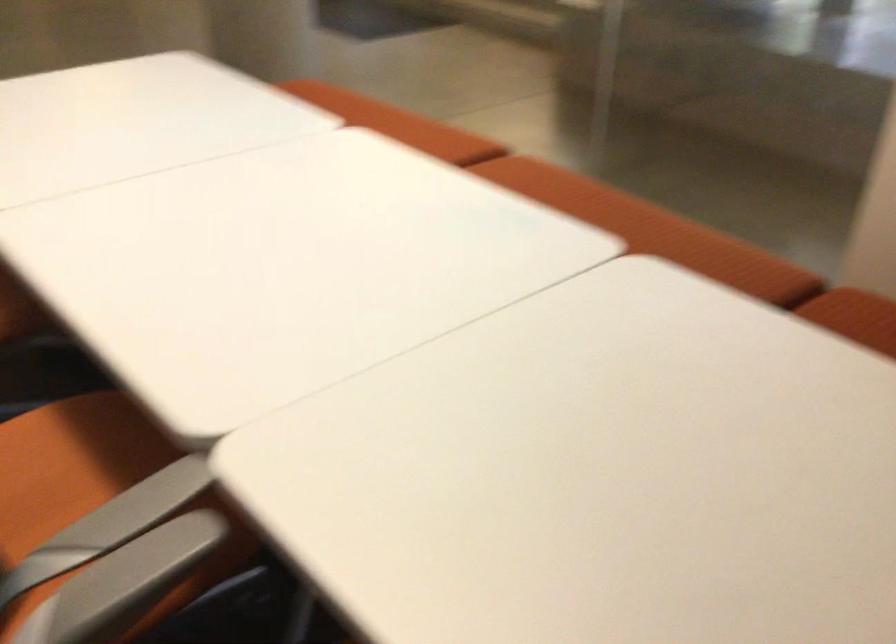
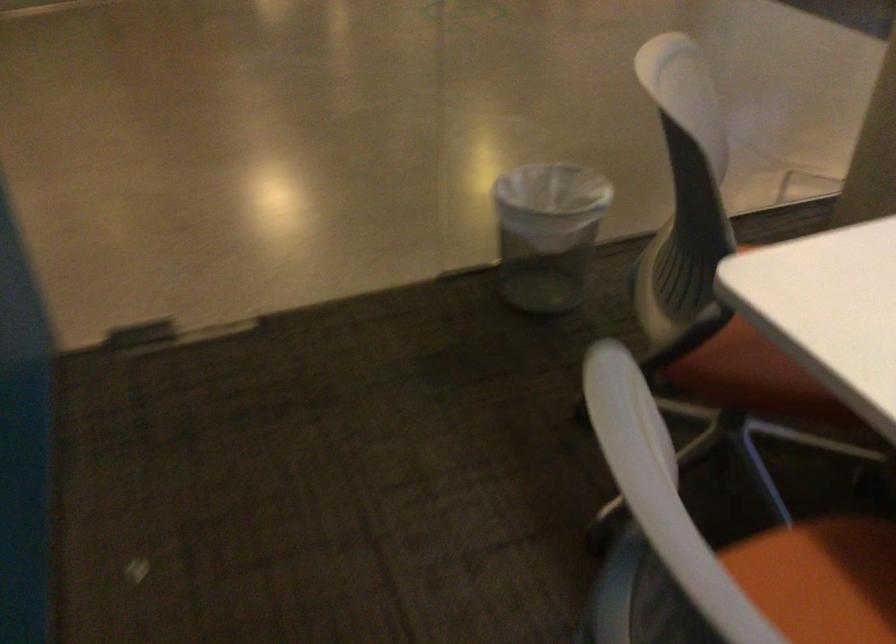
The images are taken continuously from a first-person perspective. In which direction are you moving?

The movement direction of the cameraman is left, forward.